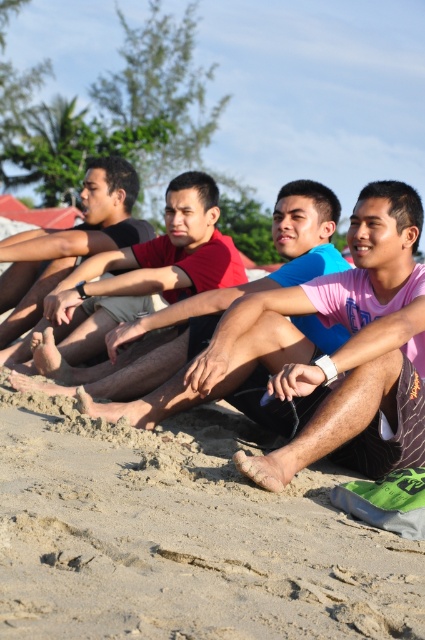
Which of these two, sandy beach at lower center or red shirt at center, stands shorter?

Standing shorter between the two is sandy beach at lower center.

Identify the location of sandy beach at lower center. This screenshot has width=425, height=640. (183, 536).

What are the coordinates of `sandy beach at lower center` in the screenshot? It's located at (183, 536).